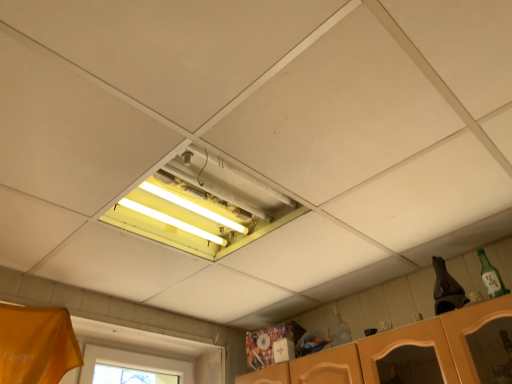
Question: Relative to green glass bottle at upper right, is yellow fluorescent light at center in front or behind?

Choices:
 (A) front
 (B) behind

Answer: (A)

Question: Is yellow fluorescent light at center to the left or to the right of green glass bottle at upper right in the image?

Choices:
 (A) right
 (B) left

Answer: (B)

Question: Is yellow fluorescent light at center situated inside green glass bottle at upper right or outside?

Choices:
 (A) outside
 (B) inside

Answer: (A)

Question: Is point (479, 251) closer or farther from the camera than point (223, 230)?

Choices:
 (A) farther
 (B) closer

Answer: (A)

Question: Is green glass bottle at upper right inside or outside of yellow fluorescent light at center?

Choices:
 (A) outside
 (B) inside

Answer: (A)

Question: Considering their positions, is green glass bottle at upper right located in front of or behind yellow fluorescent light at center?

Choices:
 (A) behind
 (B) front

Answer: (A)

Question: Is green glass bottle at upper right bigger or smaller than yellow fluorescent light at center?

Choices:
 (A) big
 (B) small

Answer: (B)